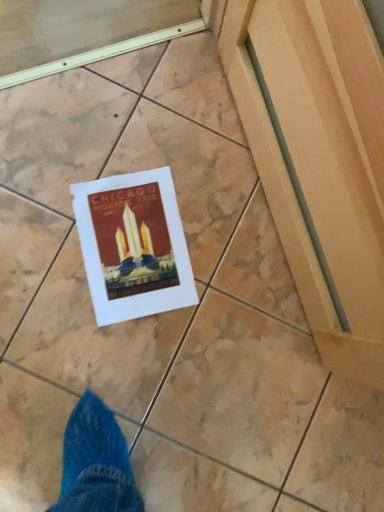
Describe the element at coordinates (133, 245) in the screenshot. Image resolution: width=384 pixels, height=512 pixels. I see `matte paper postcard at center` at that location.

Measure the distance between matte paper postcard at center and camera.

matte paper postcard at center and camera are 33.43 inches apart from each other.

Identify the location of matte paper postcard at center. The width and height of the screenshot is (384, 512). (133, 245).

You are a GUI agent. You are given a task and a screenshot of the screen. Output one action in this format:
    pyautogui.click(x=<x>, y=<y>)
    Task: Click on the matte paper postcard at center
    This screenshot has width=384, height=512.
    Given the screenshot: What is the action you would take?
    (x=133, y=245)